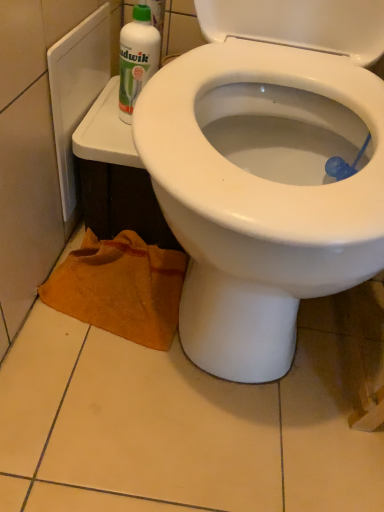
Question: Is the position of orange towel at lower left more distant than that of white glossy bidet at center?

Choices:
 (A) yes
 (B) no

Answer: (A)

Question: Does orange towel at lower left have a lesser height compared to white glossy bidet at center?

Choices:
 (A) no
 (B) yes

Answer: (B)

Question: Is orange towel at lower left oriented towards white glossy bidet at center?

Choices:
 (A) yes
 (B) no

Answer: (B)

Question: Does orange towel at lower left appear on the right side of white glossy bidet at center?

Choices:
 (A) no
 (B) yes

Answer: (A)

Question: Can you see orange towel at lower left touching white glossy bidet at center?

Choices:
 (A) yes
 (B) no

Answer: (B)

Question: Would you say white glossy bidet at center is to the left or to the right of white plastic bottle at upper left in the picture?

Choices:
 (A) left
 (B) right

Answer: (B)

Question: In the image, is white glossy bidet at center positioned in front of or behind white plastic bottle at upper left?

Choices:
 (A) front
 (B) behind

Answer: (A)

Question: From a real-world perspective, relative to white plastic bottle at upper left, is white glossy bidet at center vertically above or below?

Choices:
 (A) below
 (B) above

Answer: (A)

Question: From their relative heights in the image, would you say white glossy bidet at center is taller or shorter than white plastic bottle at upper left?

Choices:
 (A) tall
 (B) short

Answer: (A)

Question: Is point (244, 352) positioned closer to the camera than point (56, 270)?

Choices:
 (A) closer
 (B) farther

Answer: (A)

Question: From a real-world perspective, is white glossy bidet at center positioned above or below orange towel at lower left?

Choices:
 (A) below
 (B) above

Answer: (B)

Question: Based on their sizes in the image, would you say white glossy bidet at center is bigger or smaller than orange towel at lower left?

Choices:
 (A) big
 (B) small

Answer: (A)

Question: From their relative heights in the image, would you say white glossy bidet at center is taller or shorter than orange towel at lower left?

Choices:
 (A) short
 (B) tall

Answer: (B)

Question: From a real-world perspective, relative to white glossy bidet at center, is orange towel at lower left vertically above or below?

Choices:
 (A) below
 (B) above

Answer: (A)

Question: In terms of height, does orange towel at lower left look taller or shorter compared to white glossy bidet at center?

Choices:
 (A) short
 (B) tall

Answer: (A)